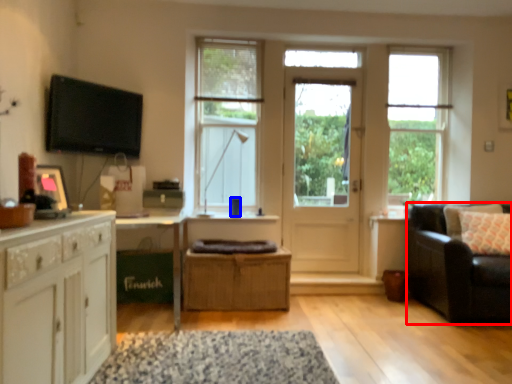
Question: Which point is closer to the camera, studio couch (highlighted by a red box) or coffee cup (highlighted by a blue box)?

Choices:
 (A) studio couch
 (B) coffee cup

Answer: (A)